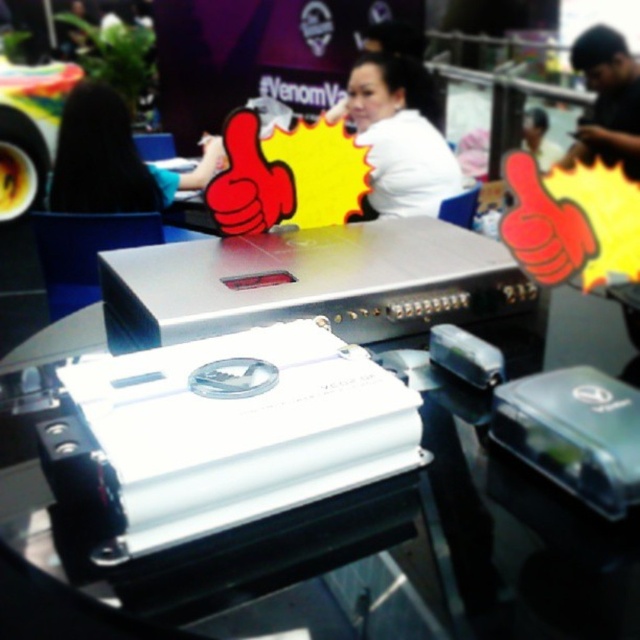
Is blonde hair at upper left below black matte shirt at upper right?

Yes, blonde hair at upper left is below black matte shirt at upper right.

Can you confirm if blonde hair at upper left is thinner than black matte shirt at upper right?

No.

Who is more distant from viewer, (x=83, y=179) or (x=593, y=58)?

Positioned behind is point (x=593, y=58).

This screenshot has width=640, height=640. I want to click on blonde hair at upper left, so click(x=113, y=160).

Locate an element on the screen. This screenshot has width=640, height=640. white matte shirt at upper center is located at coordinates (397, 138).

You are a GUI agent. You are given a task and a screenshot of the screen. Output one action in this format:
    pyautogui.click(x=<x>, y=<y>)
    Task: Click on the white matte shirt at upper center
    Image resolution: width=640 pixels, height=640 pixels.
    Given the screenshot: What is the action you would take?
    pyautogui.click(x=397, y=138)

Can you confirm if white matte shirt at upper center is positioned to the right of blonde hair at upper left?

Yes, white matte shirt at upper center is to the right of blonde hair at upper left.

Who is positioned more to the left, white matte shirt at upper center or blonde hair at upper left?

blonde hair at upper left is more to the left.

What do you see at coordinates (397, 138) in the screenshot? The width and height of the screenshot is (640, 640). I see `white matte shirt at upper center` at bounding box center [397, 138].

The width and height of the screenshot is (640, 640). I want to click on white matte shirt at upper center, so point(397,138).